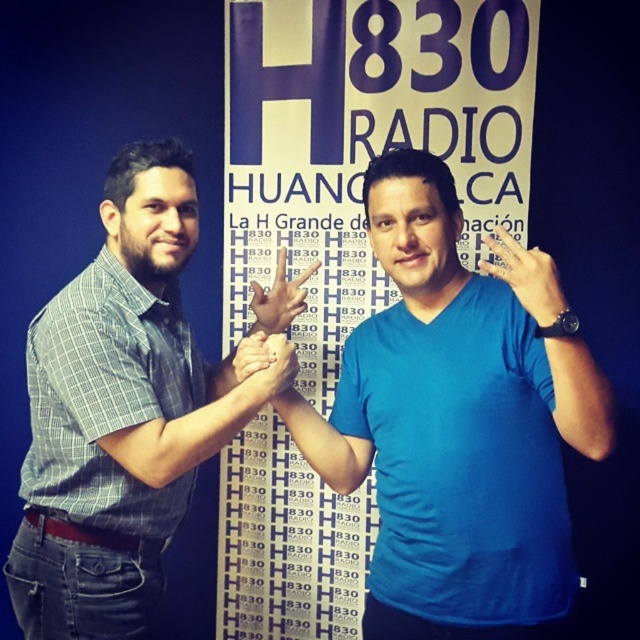
Question: Which point is closer to the camera?

Choices:
 (A) matte black hand at center
 (B) matte skin hand at center
 (C) matte blue hand at center
 (D) blue fabric poster at center

Answer: (C)

Question: Based on their relative distances, which object is farther from the gray checkered shirt at center?

Choices:
 (A) matte skin hand at center
 (B) matte blue hand at center
 (C) blue fabric poster at center
 (D) matte black hand at center

Answer: (C)

Question: Does gray checkered shirt at center have a larger size compared to matte skin hand at center?

Choices:
 (A) yes
 (B) no

Answer: (A)

Question: Can you confirm if blue fabric poster at center is positioned below gray checkered shirt at center?

Choices:
 (A) no
 (B) yes

Answer: (A)

Question: Can you confirm if matte black hand at center is bigger than matte skin hand at center?

Choices:
 (A) yes
 (B) no

Answer: (B)

Question: Among these objects, which one is nearest to the camera?

Choices:
 (A) matte skin hand at center
 (B) matte blue hand at center
 (C) gray checkered shirt at center

Answer: (B)